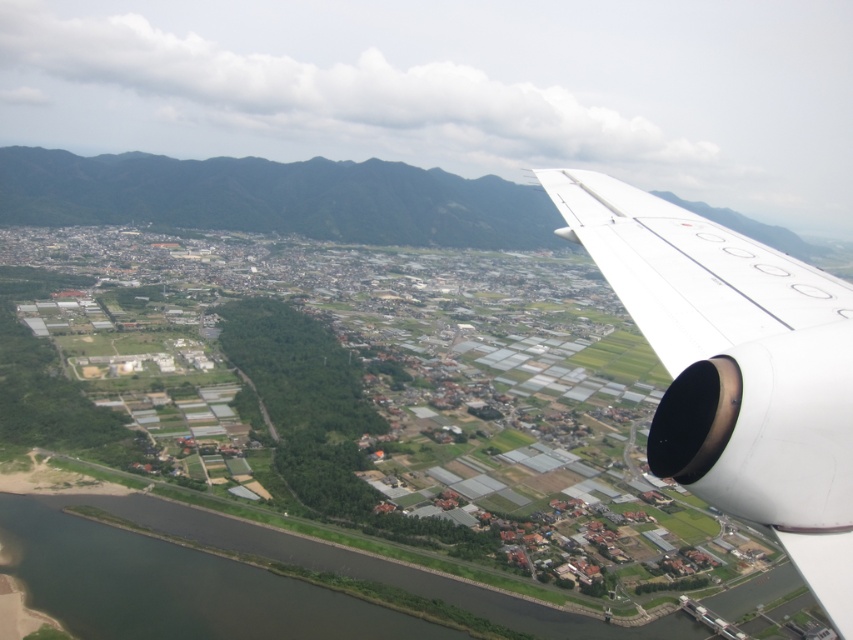
Question: Among these objects, which one is nearest to the camera?

Choices:
 (A) white matte wing at upper right
 (B) white matte airplane wing at right

Answer: (B)

Question: Can you confirm if white matte airplane wing at right is wider than white matte wing at upper right?

Choices:
 (A) yes
 (B) no

Answer: (A)

Question: Considering the relative positions of white matte airplane wing at right and white matte wing at upper right in the image provided, where is white matte airplane wing at right located with respect to white matte wing at upper right?

Choices:
 (A) right
 (B) left

Answer: (B)

Question: Among these points, which one is nearest to the camera?

Choices:
 (A) (824, 365)
 (B) (695, 353)

Answer: (A)

Question: Among these objects, which one is nearest to the camera?

Choices:
 (A) white matte wing at upper right
 (B) white matte airplane wing at right

Answer: (B)

Question: Can you confirm if white matte airplane wing at right is positioned to the left of white matte wing at upper right?

Choices:
 (A) yes
 (B) no

Answer: (A)